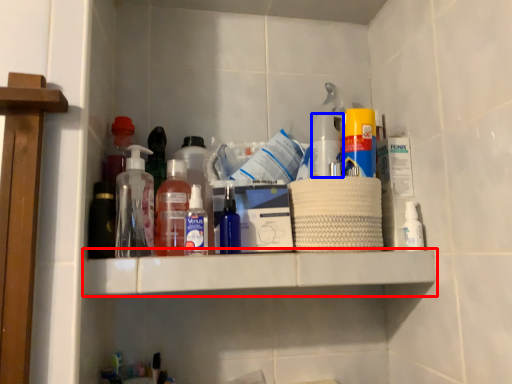
Question: Which object appears closest to the camera in this image, shelf (highlighted by a red box) or bottle (highlighted by a blue box)?

Choices:
 (A) shelf
 (B) bottle

Answer: (A)